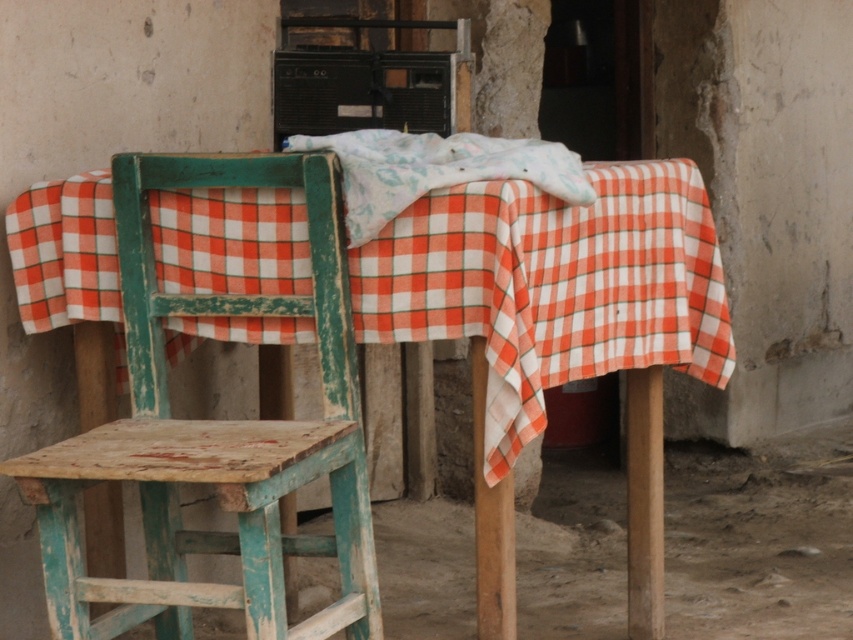
You are trying to place a decorative vase on the table between the wooden chair at left and the white cotton cloth at center. The vase is 20 inches wide. Will it fit between them?

The distance between the wooden chair at left and the white cotton cloth at center is 19.72 inches, which is slightly less than the vase width of 20 inches. Therefore, the vase will not fit between them.

Looking at this image, you are trying to decide whether to place a small potted plant on the chipped teal wood stool at left or the white cotton cloth at center. Based on their heights, which surface would allow the plant to be seen more easily from across the room?

The chipped teal wood stool at left is taller than the white cotton cloth at center, so placing the plant on the stool would make it more visible from across the room.

You are a delivery person trying to place a package that measures 24 inches in length between the chipped teal wood stool at left and the white cotton cloth at center. Will the package fit in the space between them?

The chipped teal wood stool at left and white cotton cloth at center are 26.12 inches apart from each other. Since the package is 24 inches long, it will fit in the space between them as the distance is greater than the package length.